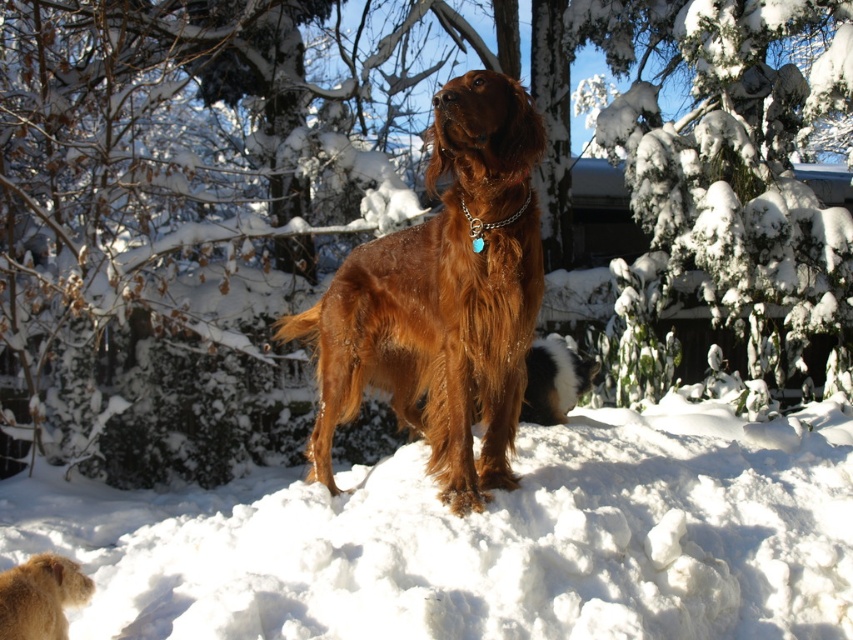
Question: Which point is farther from the camera taking this photo?

Choices:
 (A) (541, 348)
 (B) (474, 132)
 (C) (276, 541)
 (D) (715, 301)

Answer: (D)

Question: Is golden fur dog at lower left to the left of black and white fur at center from the viewer's perspective?

Choices:
 (A) no
 (B) yes

Answer: (B)

Question: Is green textured pine tree at upper right above brown furry dog at center?

Choices:
 (A) no
 (B) yes

Answer: (B)

Question: From the image, what is the correct spatial relationship of white fluffy snow at center in relation to green textured pine tree at upper right?

Choices:
 (A) right
 (B) left

Answer: (B)

Question: Which of the following is the farthest from the observer?

Choices:
 (A) (733, 8)
 (B) (445, 342)
 (C) (219, 632)

Answer: (A)

Question: Which of the following is the farthest from the observer?

Choices:
 (A) black and white fur at center
 (B) white fluffy snow at center

Answer: (B)